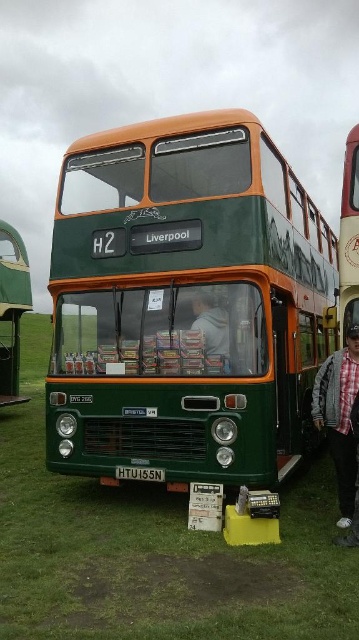
You are a photographer standing in the field and want to capture both the plaid fabric shirt at lower right and the green matte bus at left in the same frame. Which object should you focus on first to ensure both are in focus?

You should focus on the plaid fabric shirt at lower right first because it is closer to you than the green matte bus at left, so focusing on the closer object will help both be in focus.

You are standing in the field and see the green grass at center and the green fabric jacket at center. Which object is taller?

The green fabric jacket at center is taller than the green grass at center.